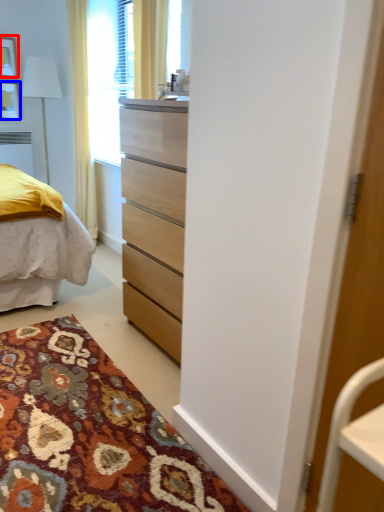
Question: Which object is closer to the camera taking this photo, picture frame (highlighted by a red box) or picture frame (highlighted by a blue box)?

Choices:
 (A) picture frame
 (B) picture frame

Answer: (A)